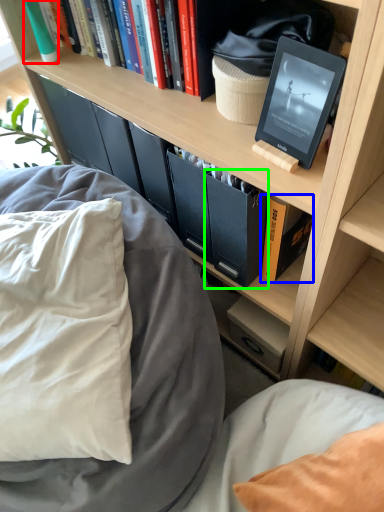
Question: Estimate the real-world distances between objects in this image. Which object is farther from book (highlighted by a red box), book (highlighted by a blue box) or paperback book (highlighted by a green box)?

Choices:
 (A) book
 (B) paperback book

Answer: (A)